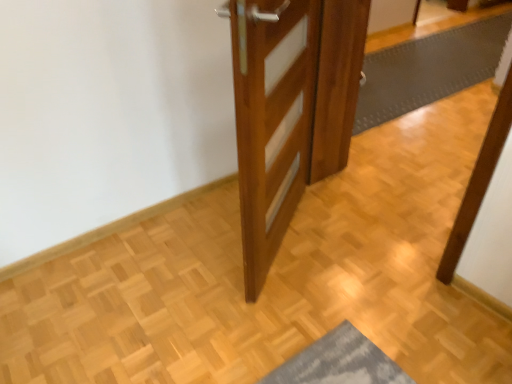
Locate an element on the screen. vacant space in wooden door at center (from a real-world perspective) is located at coordinates (284, 238).